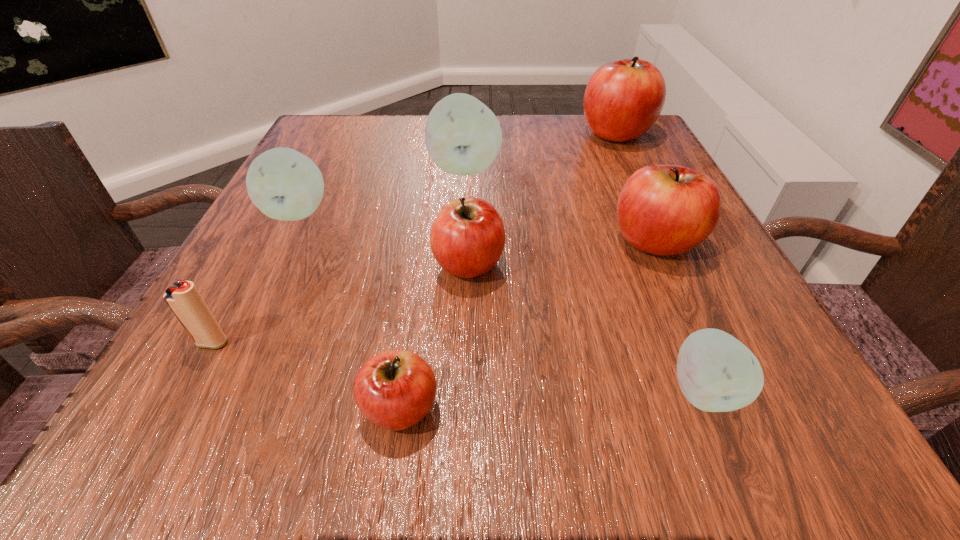
Locate an element on the screen. Image resolution: width=960 pixels, height=540 pixels. blank region between the rightmost white apple and the second smallest red apple is located at coordinates (586, 327).

What are the coordinates of `free area in between the igniter and the second biggest red apple` in the screenshot? It's located at (434, 292).

Identify the location of free point between the farthest white apple and the leftmost white apple. The width and height of the screenshot is (960, 540). (381, 190).

Where is `vacant space that is in between the second biggest red apple and the nearest red apple`? The width and height of the screenshot is (960, 540). vacant space that is in between the second biggest red apple and the nearest red apple is located at coordinates (528, 325).

Locate an element on the screen. Image resolution: width=960 pixels, height=540 pixels. free spot between the farthest red apple and the smallest red apple is located at coordinates (508, 271).

In order to click on vacant space that is in between the smallest red apple and the second smallest red apple in this screenshot , I will do `click(434, 336)`.

You are a GUI agent. You are given a task and a screenshot of the screen. Output one action in this format:
    pyautogui.click(x=<x>, y=<y>)
    Task: Click on the empty location between the nearest red apple and the farthest red apple
    Image resolution: width=960 pixels, height=540 pixels.
    Given the screenshot: What is the action you would take?
    pyautogui.click(x=508, y=271)

Choose which object is the nearest neighbor to the second nearest white apple. Please provide its 2D coordinates. Your answer should be formatted as a tuple, i.e. [(x, y)], where the tuple contains the x and y coordinates of a point satisfying the conditions above.

[(463, 136)]

Find the location of a particular element. Image resolution: width=960 pixels, height=540 pixels. object that is the third closest to the farthest white apple is located at coordinates (623, 99).

Where is `apple that is the fifth nearest to the biggest white apple`? apple that is the fifth nearest to the biggest white apple is located at coordinates (394, 390).